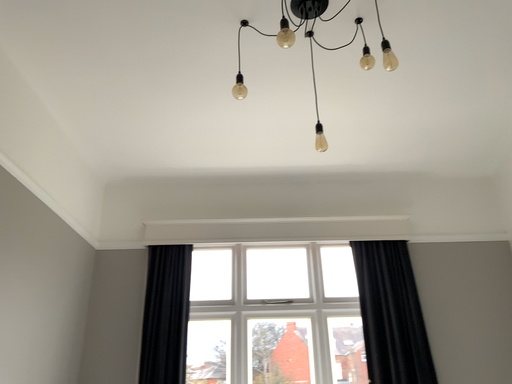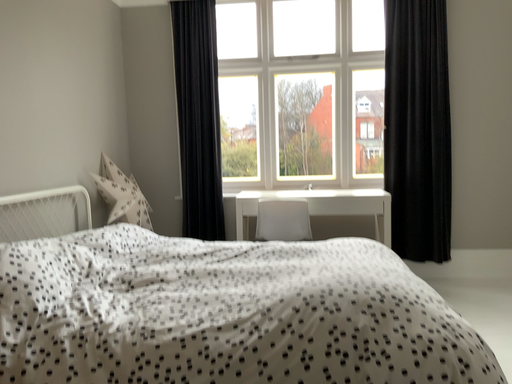
Question: Which way did the camera rotate in the video?

Choices:
 (A) rotated upward
 (B) rotated downward

Answer: (B)